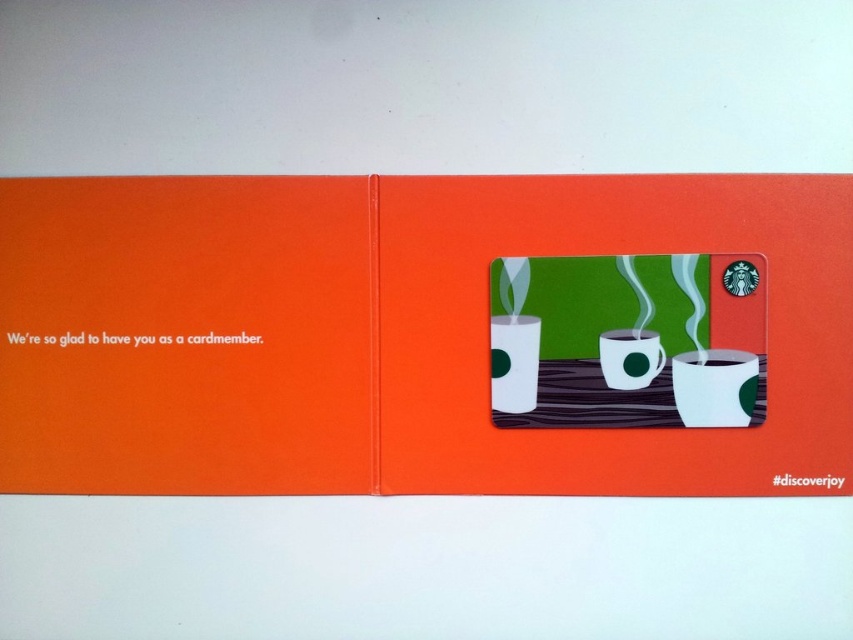
Question: Which point appears farthest from the camera in this image?

Choices:
 (A) (610, 336)
 (B) (531, 349)
 (C) (676, 387)

Answer: (B)

Question: Estimate the real-world distances between objects in this image. Which object is farther from the white glossy mug at center?

Choices:
 (A) white glossy mug at upper right
 (B) green matte cup at center
 (C) matte plastic starbucks card at right

Answer: (C)

Question: Does white glossy mug at upper right have a larger size compared to green matte cup at center?

Choices:
 (A) yes
 (B) no

Answer: (A)

Question: Based on their relative distances, which object is farther from the matte plastic starbucks card at right?

Choices:
 (A) green matte cup at center
 (B) white glossy mug at upper right

Answer: (A)

Question: Is white glossy mug at upper right smaller than white glossy mug at center?

Choices:
 (A) yes
 (B) no

Answer: (B)

Question: Is white glossy mug at center positioned behind green matte cup at center?

Choices:
 (A) no
 (B) yes

Answer: (B)